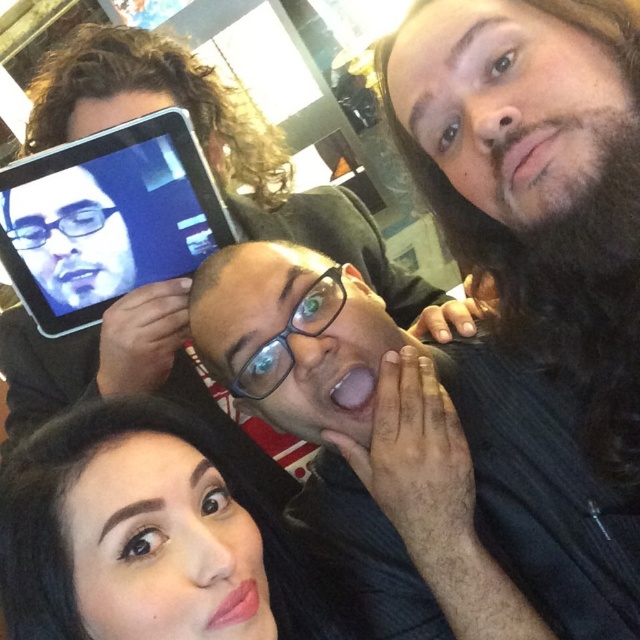
Question: Does shiny black hair at lower left have a lesser width compared to black plastic tablet at upper left?

Choices:
 (A) no
 (B) yes

Answer: (B)

Question: Which of the following is the closest to the observer?

Choices:
 (A) black plastic tablet at upper left
 (B) shiny black hair at lower left

Answer: (B)

Question: Is shiny black hair at lower left in front of black plastic tablet at upper left?

Choices:
 (A) no
 (B) yes

Answer: (B)

Question: Is shiny black hair at lower left positioned behind black plastic tablet at upper left?

Choices:
 (A) yes
 (B) no

Answer: (B)